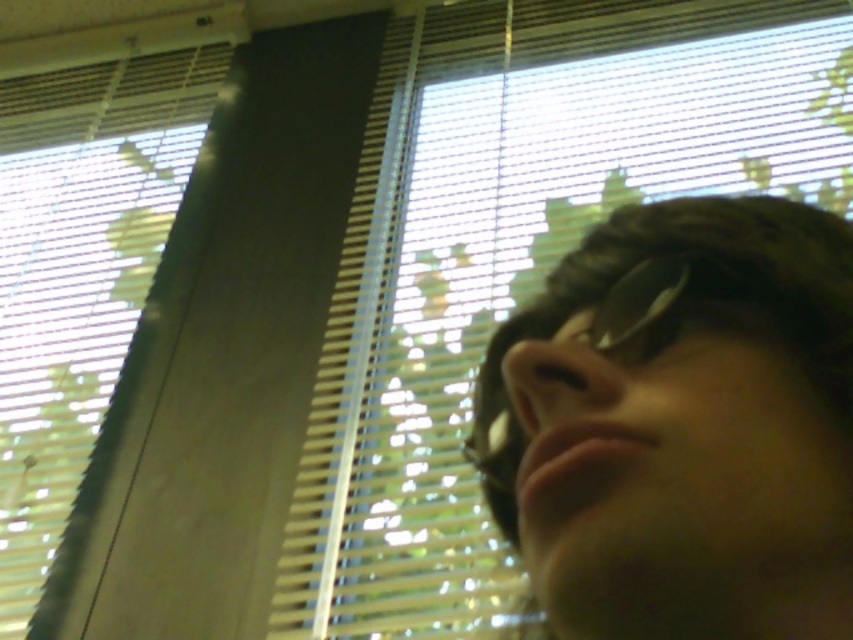
Question: Can you confirm if white plastic blinds at upper center is thinner than matte black sunglasses at right?

Choices:
 (A) no
 (B) yes

Answer: (A)

Question: Which point is farther to the camera?

Choices:
 (A) (415, 426)
 (B) (584, 492)
 (C) (61, 113)

Answer: (C)

Question: Can you confirm if matte black sunglasses at right is thinner than white plastic blinds at upper left?

Choices:
 (A) no
 (B) yes

Answer: (B)

Question: Does white plastic blinds at upper center appear on the right side of white plastic blinds at upper left?

Choices:
 (A) no
 (B) yes

Answer: (B)

Question: Which point is closer to the camera?

Choices:
 (A) white plastic blinds at upper center
 (B) matte black sunglasses at right
 (C) white plastic blinds at upper left

Answer: (B)

Question: Among these objects, which one is nearest to the camera?

Choices:
 (A) sunglasses at center
 (B) white plastic blinds at upper left
 (C) matte black sunglasses at right
 (D) white plastic blinds at upper center

Answer: (C)